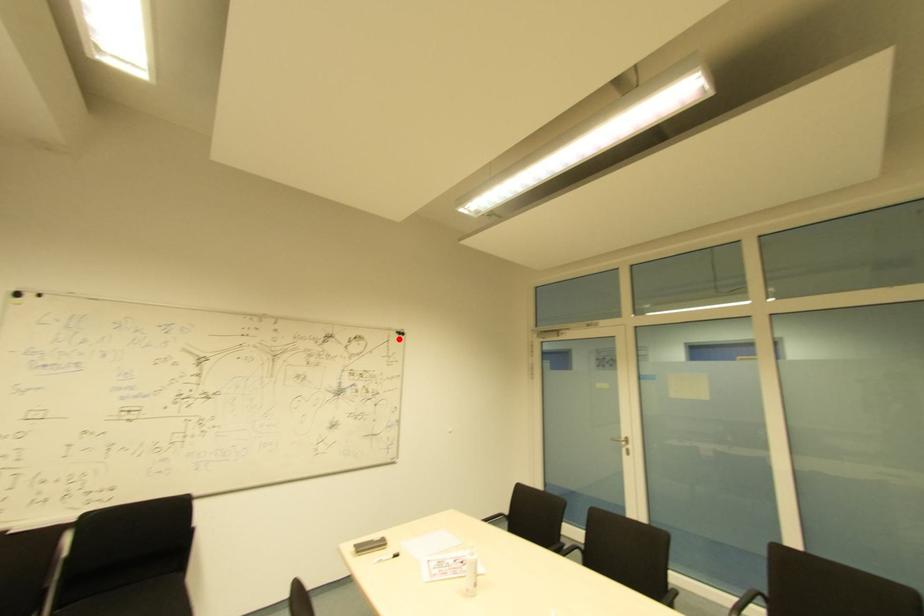
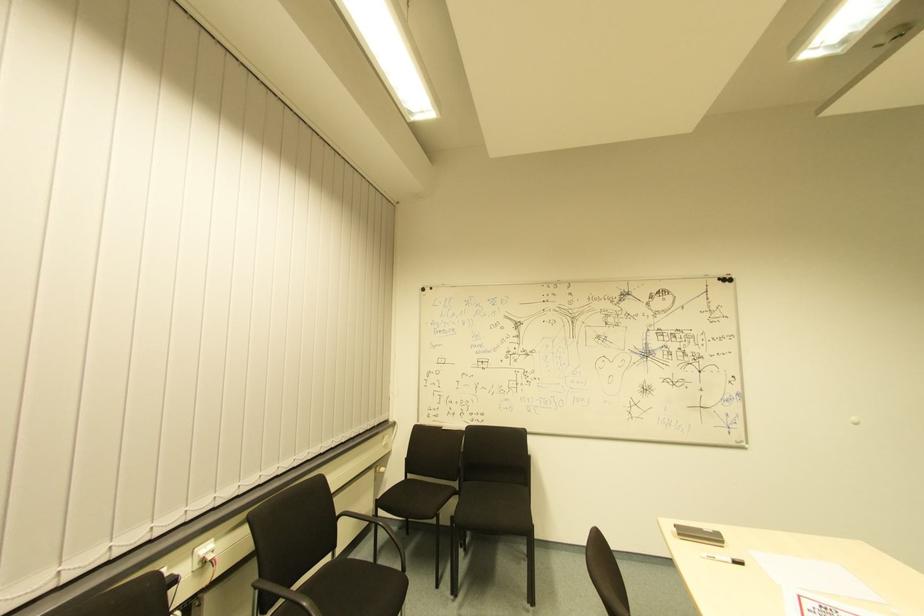
Locate, in the second image, the point that corresponds to the highlighted location in the first image.

(725, 286)